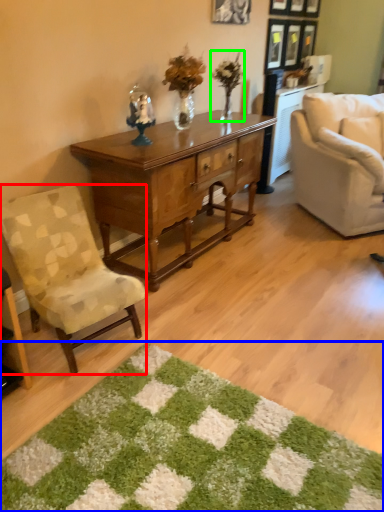
Question: Which object is positioned closest to chair (highlighted by a red box)? Select from mat (highlighted by a blue box) and houseplant (highlighted by a green box).

Choices:
 (A) mat
 (B) houseplant

Answer: (A)